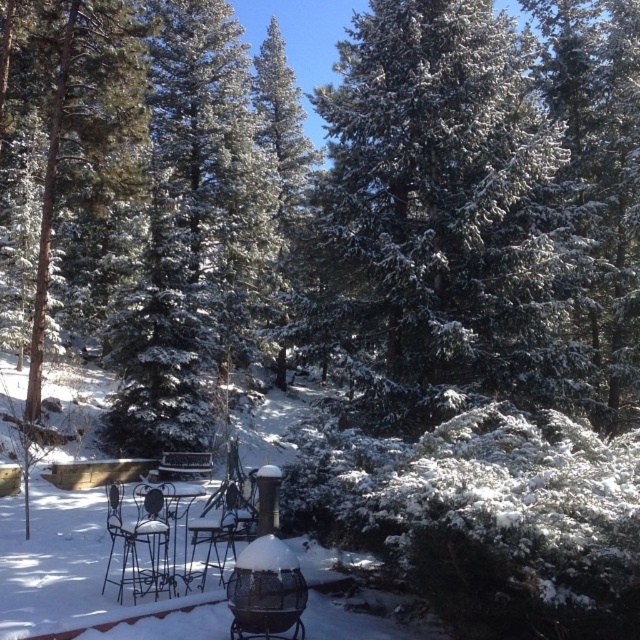
Can you confirm if snow-covered evergreen at center is positioned to the left of black wrought iron chair at center?

Incorrect, snow-covered evergreen at center is not on the left side of black wrought iron chair at center.

Image resolution: width=640 pixels, height=640 pixels. I want to click on snow-covered evergreen at center, so click(442, 224).

Does black wrought iron chair at center appear under metallic silver table at center?

No, black wrought iron chair at center is not below metallic silver table at center.

Is black wrought iron chair at center to the left of metallic silver table at center from the viewer's perspective?

No, black wrought iron chair at center is not to the left of metallic silver table at center.

Who is more distant from viewer, [113,538] or [188,493]?

The point [188,493] is behind.

Where is `black wrought iron chair at center`? black wrought iron chair at center is located at coordinates (138, 545).

Is snow-covered evergreen at center bigger than metallic silver table at center?

Yes.

Is point (380, 35) positioned after point (186, 579)?

That is True.

Is point (435, 403) positioned before point (140, 497)?

Yes, point (435, 403) is in front of point (140, 497).

You are a GUI agent. You are given a task and a screenshot of the screen. Output one action in this format:
    pyautogui.click(x=<x>, y=<y>)
    Task: Click on the snow-covered evergreen at center
    
    Given the screenshot: What is the action you would take?
    pyautogui.click(x=442, y=224)